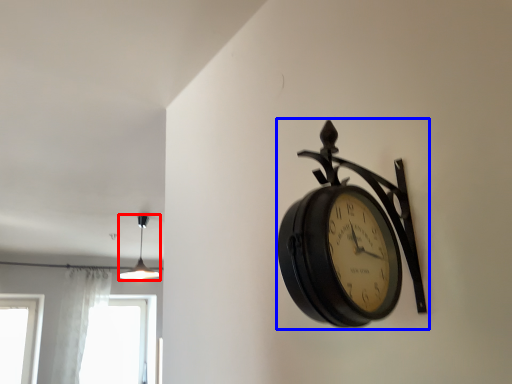
Question: Which object is further to the camera taking this photo, lamp (highlighted by a red box) or wall clock (highlighted by a blue box)?

Choices:
 (A) lamp
 (B) wall clock

Answer: (A)